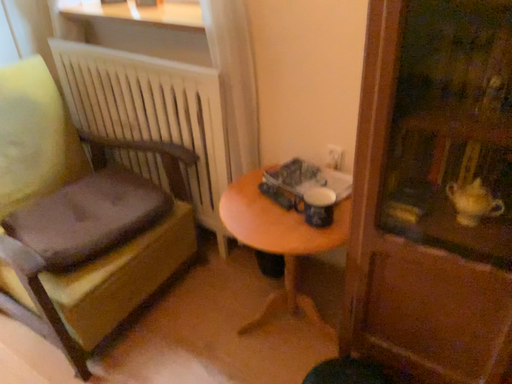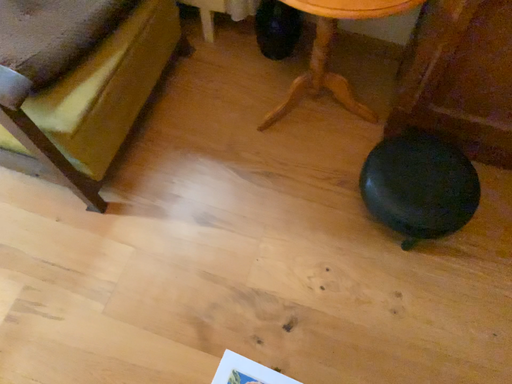
Question: Which way did the camera rotate in the video?

Choices:
 (A) rotated upward
 (B) rotated downward

Answer: (B)